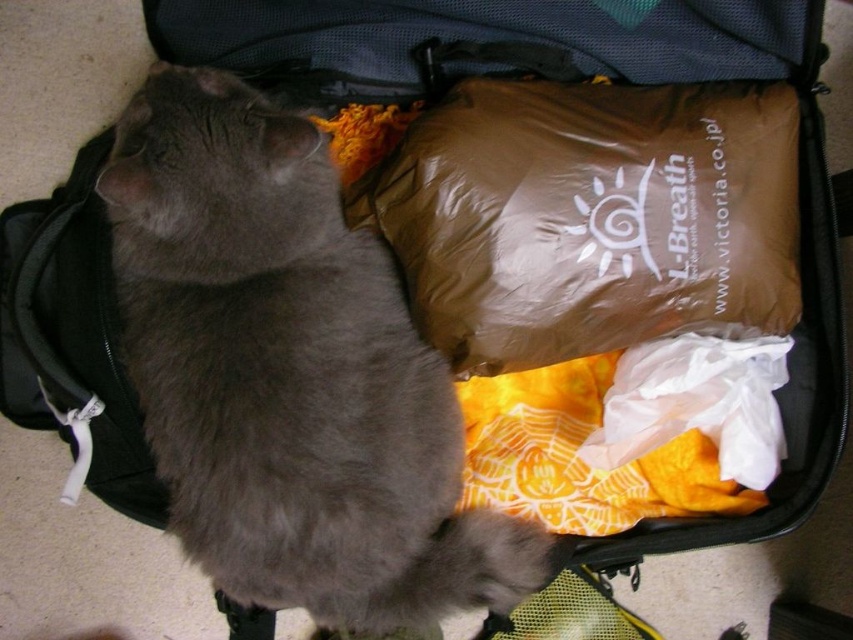
At what (x,y) coordinates should I click in order to perform the action: click on gray fur cat at center. Please return your answer as a coordinate pair (x, y). Looking at the image, I should click on (289, 372).

In order to click on gray fur cat at center in this screenshot , I will do `click(289, 372)`.